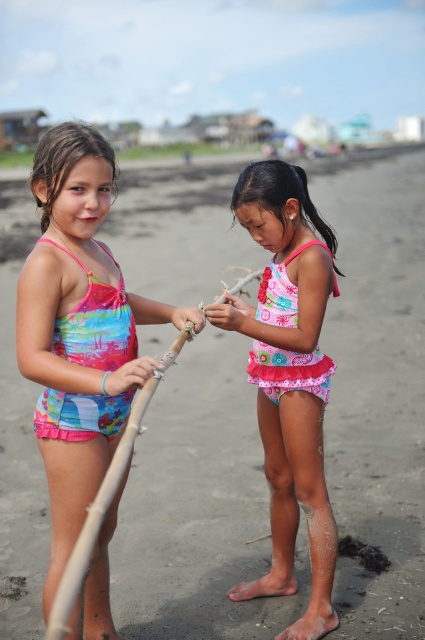
Question: Does multicolored fabric swimsuit at center appear on the left side of pink fabric swimsuit at center?

Choices:
 (A) no
 (B) yes

Answer: (B)

Question: Can you confirm if multicolored fabric swimsuit at center is positioned to the left of pink fabric swimsuit at center?

Choices:
 (A) no
 (B) yes

Answer: (B)

Question: Does multicolored fabric swimsuit at center have a greater width compared to pink fabric swimsuit at center?

Choices:
 (A) no
 (B) yes

Answer: (B)

Question: Which point is farther to the camera?

Choices:
 (A) (65, 252)
 (B) (272, 397)

Answer: (B)